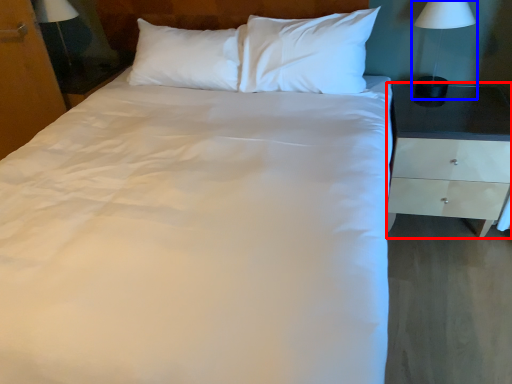
Question: Which object appears closest to the camera in this image, nightstand (highlighted by a red box) or bedside lamp (highlighted by a blue box)?

Choices:
 (A) nightstand
 (B) bedside lamp

Answer: (A)